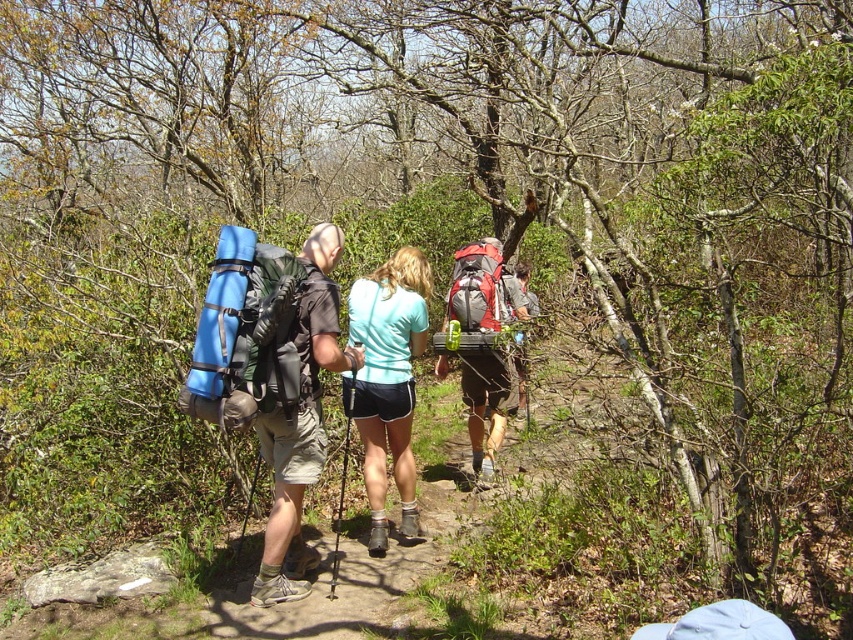
You are a hiker planning to carry both the blue padded backpack at left and the matte gray backpack at center. Given their sizes, which one should you choose as your primary backpack for carrying more gear?

The matte gray backpack at center is larger than the blue padded backpack at left, so it should be chosen as the primary backpack for carrying more gear.

You are a hiker who wants to pick up the red fabric backpack at center without moving from your current position. Can you reach it if you are standing next to the teal fabric shorts at center?

The distance between the teal fabric shorts at center and the red fabric backpack at center is 3.78 feet. Since the average human arm span is about 3 feet, you would not be able to reach the red fabric backpack at center from the teal fabric shorts at center without moving.